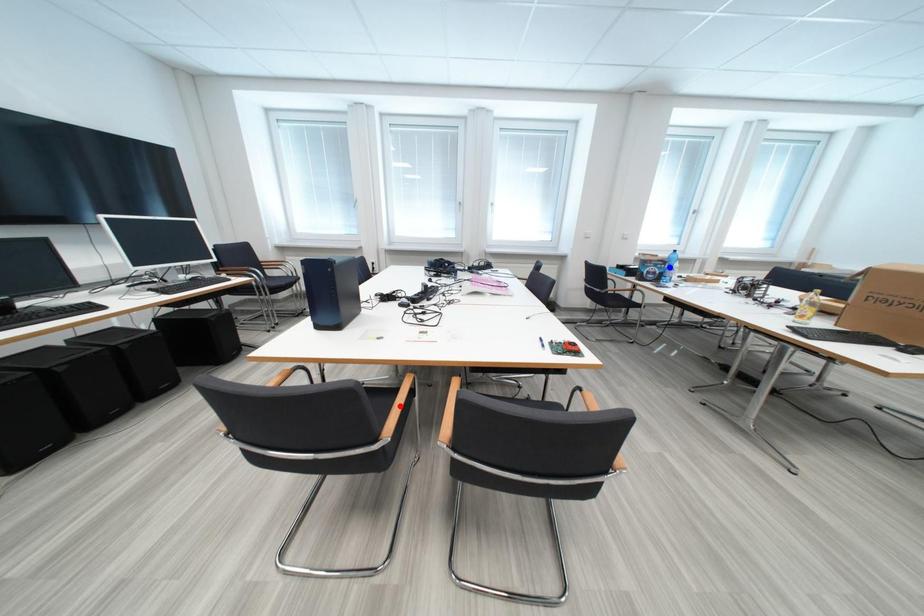
Question: In the image, two points are highlighted. Which point is nearer to the camera? Reply with the corresponding letter.

Choices:
 (A) blue point
 (B) red point

Answer: (B)